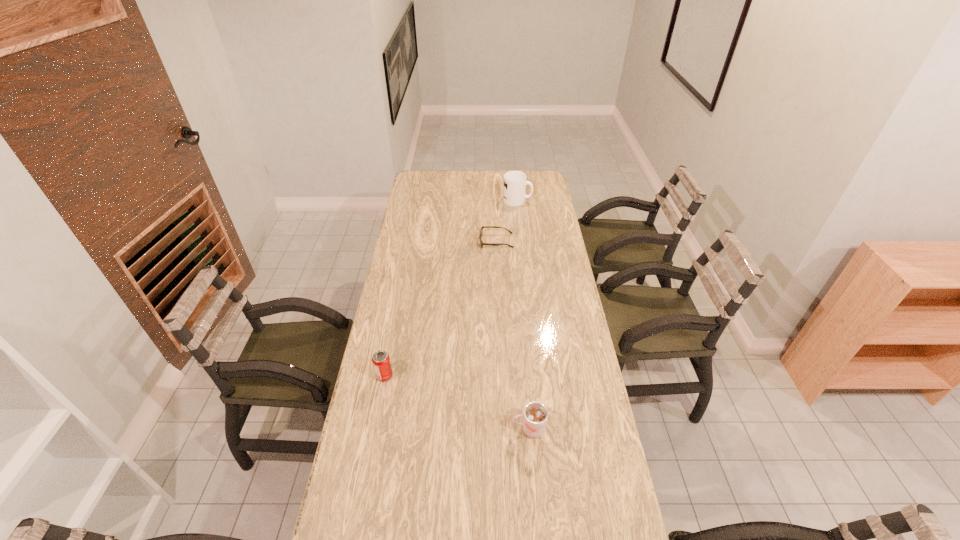
This screenshot has height=540, width=960. Find the location of `the tallest object`. the tallest object is located at coordinates (515, 182).

You are a GUI agent. You are given a task and a screenshot of the screen. Output one action in this format:
    pyautogui.click(x=<x>, y=<y>)
    Task: Click on the farthest object
    This screenshot has width=960, height=540.
    Given the screenshot: What is the action you would take?
    pyautogui.click(x=515, y=182)

Where is `the nearest object`? the nearest object is located at coordinates (535, 416).

Find the location of `soda can`. soda can is located at coordinates (381, 362).

You are a GUI agent. You are given a task and a screenshot of the screen. Output one action in this format:
    pyautogui.click(x=<x>, y=<y>)
    Task: Click on the leftmost object
    This screenshot has width=960, height=540.
    Given the screenshot: What is the action you would take?
    pyautogui.click(x=381, y=362)

Where is `the second farthest object`? The image size is (960, 540). the second farthest object is located at coordinates (481, 230).

I want to click on the shortest object, so click(481, 230).

Where is `vacant space situated 0.070m on the handle side of the mug`? Image resolution: width=960 pixels, height=540 pixels. vacant space situated 0.070m on the handle side of the mug is located at coordinates [x=545, y=200].

Locate an element on the screen. blank space located on the side with the handle of the cup is located at coordinates (395, 429).

Find the location of a particular element. The image size is (960, 540). vacant space positioned 0.160m on the side with the handle of the cup is located at coordinates (459, 429).